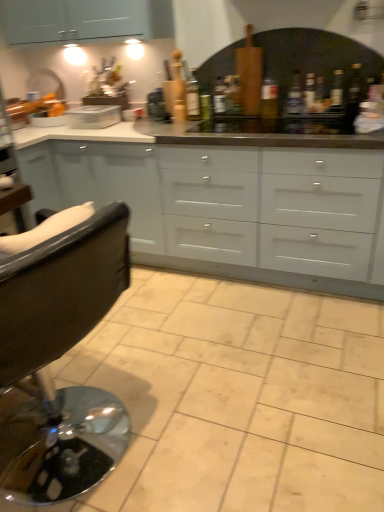
Question: From a real-world perspective, does matte glass bottle at center, the fourth bottle viewed from the right, sit lower than white matte cupboard at center?

Choices:
 (A) yes
 (B) no

Answer: (B)

Question: Is white matte cupboard at center located within matte glass bottle at center, marked as the third bottle in a left-to-right arrangement?

Choices:
 (A) yes
 (B) no

Answer: (B)

Question: From the image's perspective, is matte glass bottle at center, the fourth bottle viewed from the right, located above white matte cupboard at center?

Choices:
 (A) no
 (B) yes

Answer: (B)

Question: Is matte glass bottle at center, the fourth bottle viewed from the right, facing towards white matte cupboard at center?

Choices:
 (A) no
 (B) yes

Answer: (A)

Question: From a real-world perspective, does matte glass bottle at center, the fourth bottle viewed from the right, stand above white matte cupboard at center?

Choices:
 (A) no
 (B) yes

Answer: (B)

Question: Considering the relative positions of matte glass bottle at center, the fourth bottle viewed from the right, and white matte cupboard at center in the image provided, is matte glass bottle at center, the fourth bottle viewed from the right, to the left of white matte cupboard at center from the viewer's perspective?

Choices:
 (A) yes
 (B) no

Answer: (B)

Question: Is beige ceramic tile at center facing towards black leather chair at left?

Choices:
 (A) no
 (B) yes

Answer: (A)

Question: Considering the relative positions of beige ceramic tile at center and black leather chair at left in the image provided, is beige ceramic tile at center to the right of black leather chair at left from the viewer's perspective?

Choices:
 (A) no
 (B) yes

Answer: (B)

Question: Would you consider beige ceramic tile at center to be distant from black leather chair at left?

Choices:
 (A) yes
 (B) no

Answer: (B)

Question: From the image's perspective, is beige ceramic tile at center located beneath black leather chair at left?

Choices:
 (A) no
 (B) yes

Answer: (B)

Question: Does beige ceramic tile at center have a larger size compared to black leather chair at left?

Choices:
 (A) yes
 (B) no

Answer: (B)

Question: Is beige ceramic tile at center taller than black leather chair at left?

Choices:
 (A) yes
 (B) no

Answer: (B)

Question: Does green glass bottle at center, placed as the 2th bottle when sorted from left to right, have a lesser width compared to beige ceramic tile at center?

Choices:
 (A) yes
 (B) no

Answer: (A)